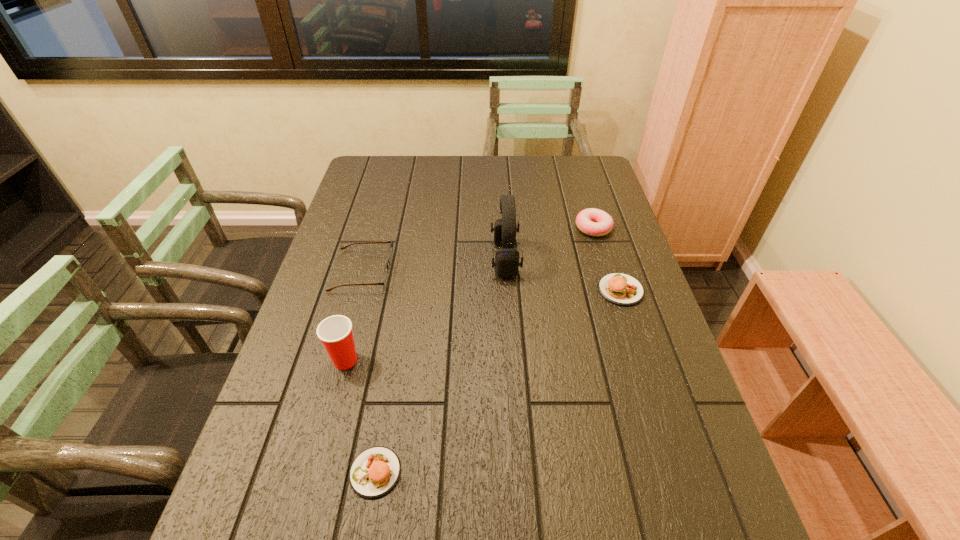
Locate an element on the screen. This screenshot has width=960, height=540. spot to insert another patty_(food) for uniform distribution is located at coordinates (519, 366).